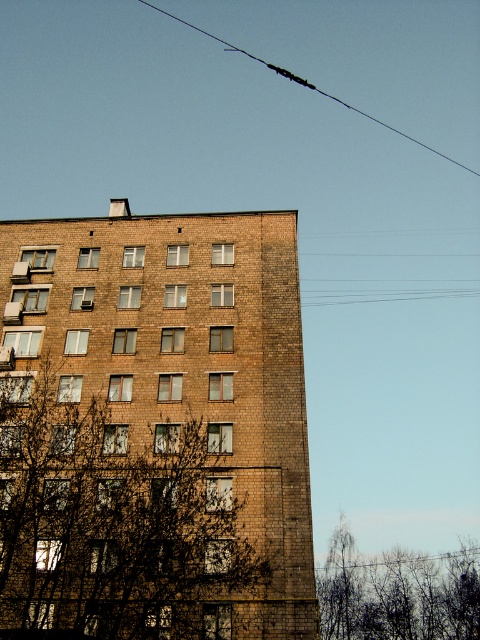
Is brown brick building at center behind bare branches at lower right?

No.

Does point (61, 536) come in front of point (455, 589)?

That is True.

At what (x,y) coordinates should I click in order to perform the action: click on brown brick building at center. Please return your answer as a coordinate pair (x, y). Looking at the image, I should click on (154, 428).

Is point (286, 339) positioned in front of point (196, 26)?

Yes, point (286, 339) is in front of point (196, 26).

Which is more to the right, brown brick building at center or black wire at upper center?

From the viewer's perspective, black wire at upper center appears more on the right side.

The width and height of the screenshot is (480, 640). Describe the element at coordinates (154, 428) in the screenshot. I see `brown brick building at center` at that location.

Where is `brown brick building at center`? Image resolution: width=480 pixels, height=640 pixels. brown brick building at center is located at coordinates (154, 428).

Who is positioned more to the left, bare branches at lower right or black wire at upper center?

black wire at upper center is more to the left.

Between point (455, 618) and point (368, 116), which one is positioned in front?

Point (455, 618) is in front.

Does point (321, 577) lie behind point (365, 113)?

No, it is in front of (365, 113).

What are the coordinates of `bare branches at lower right` in the screenshot? It's located at (397, 593).